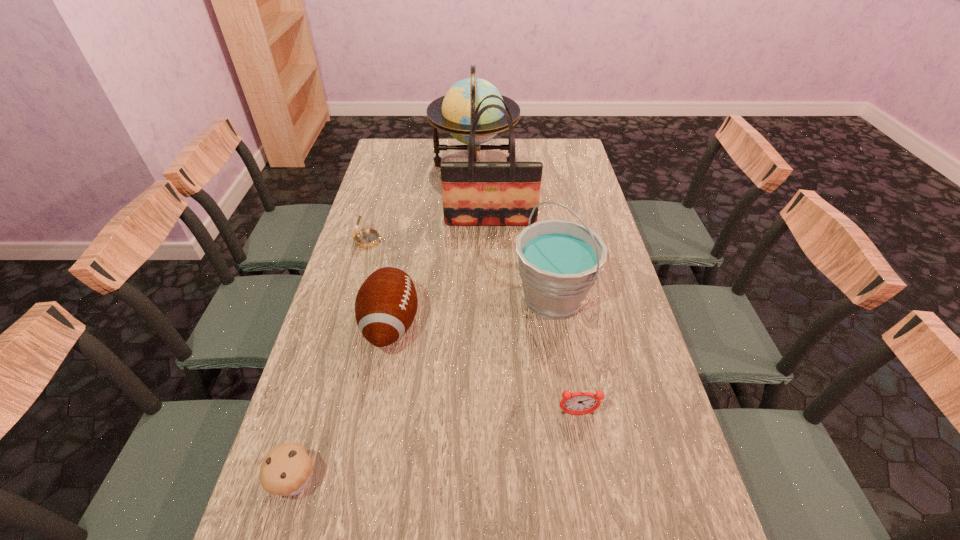
Locate an element on the screen. vacant area at the far edge is located at coordinates (478, 162).

Identify the location of vacant area at the left edge. (396, 217).

Where is `vacant space at the right edge of the desktop`? The image size is (960, 540). vacant space at the right edge of the desktop is located at coordinates (571, 186).

Identify the location of vacant space at the far left corner of the desktop. tap(396, 141).

I want to click on blank region between the farthest object and the bucket, so click(x=514, y=232).

Image resolution: width=960 pixels, height=540 pixels. Identify the location of free space between the sixth farthest object and the football. (484, 369).

I want to click on vacant area between the muffin and the fourth shortest object, so click(344, 403).

This screenshot has width=960, height=540. I want to click on vacant space in between the nearest object and the sixth farthest object, so click(437, 448).

I want to click on free space between the alarm clock and the muffin, so click(437, 448).

Select which object appears as the fourth closest to the farthest object. Please provide its 2D coordinates. Your answer should be formatted as a tuple, i.e. [(x, y)], where the tuple contains the x and y coordinates of a point satisfying the conditions above.

[(386, 304)]